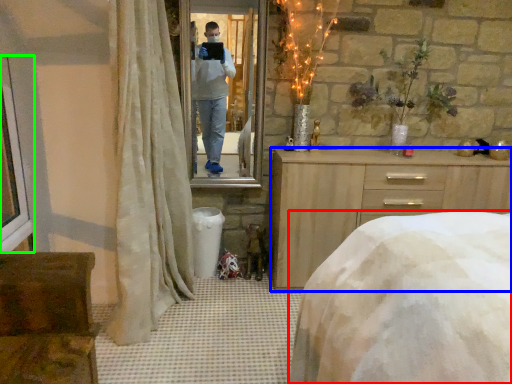
Question: Estimate the real-world distances between objects in this image. Which object is farther from bed (highlighted by a red box), chest of drawers (highlighted by a blue box) or window frame (highlighted by a green box)?

Choices:
 (A) chest of drawers
 (B) window frame

Answer: (B)